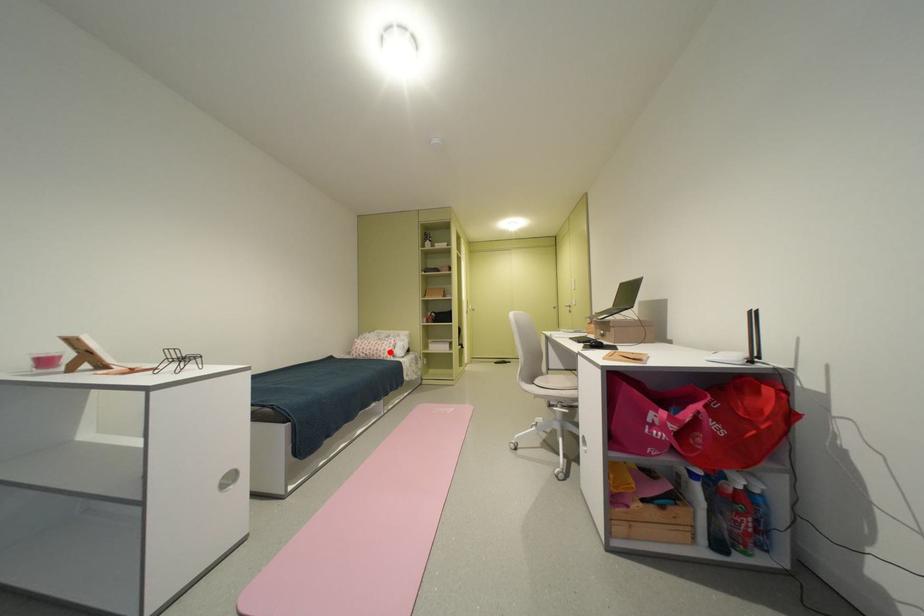
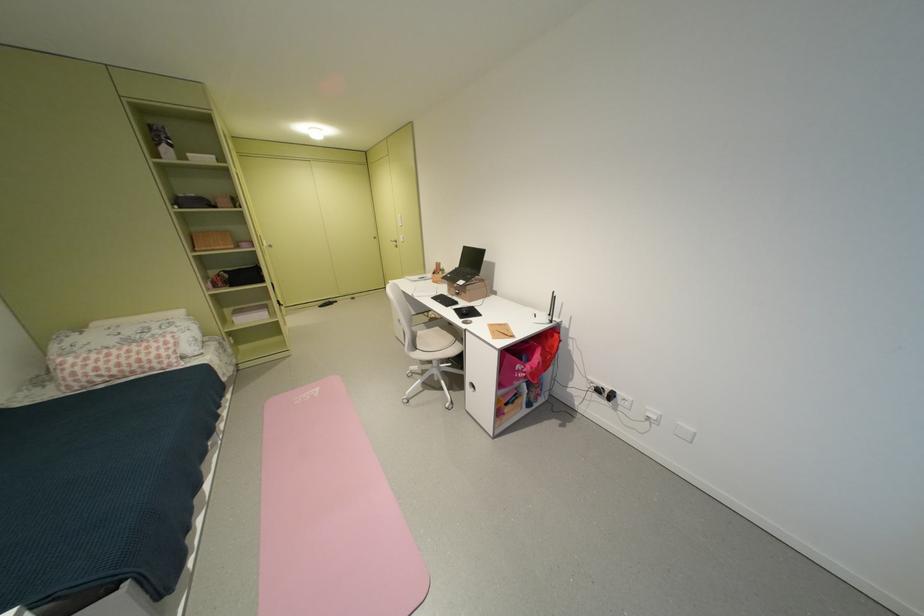
Where in the second image is the point corresponding to the highlighted location from the first image?

(159, 362)